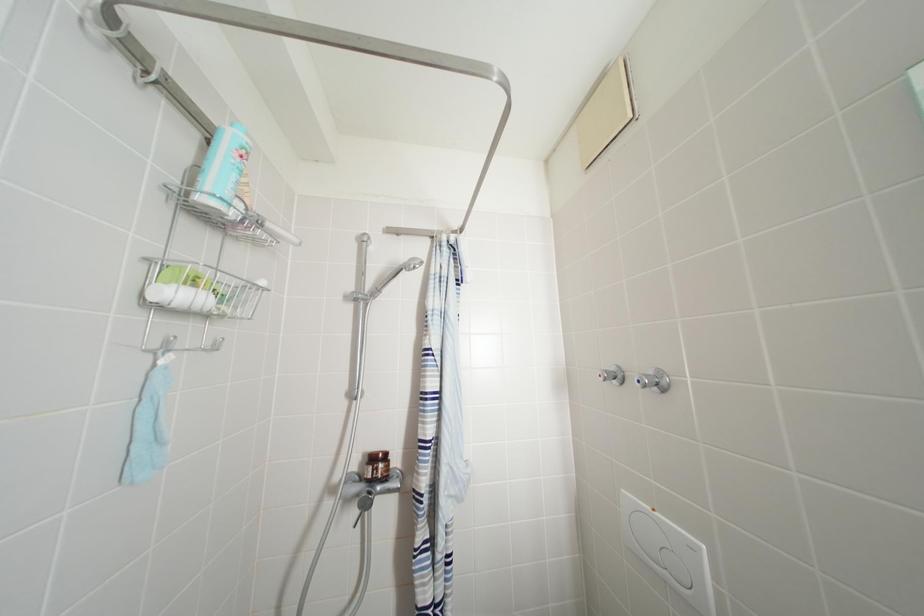
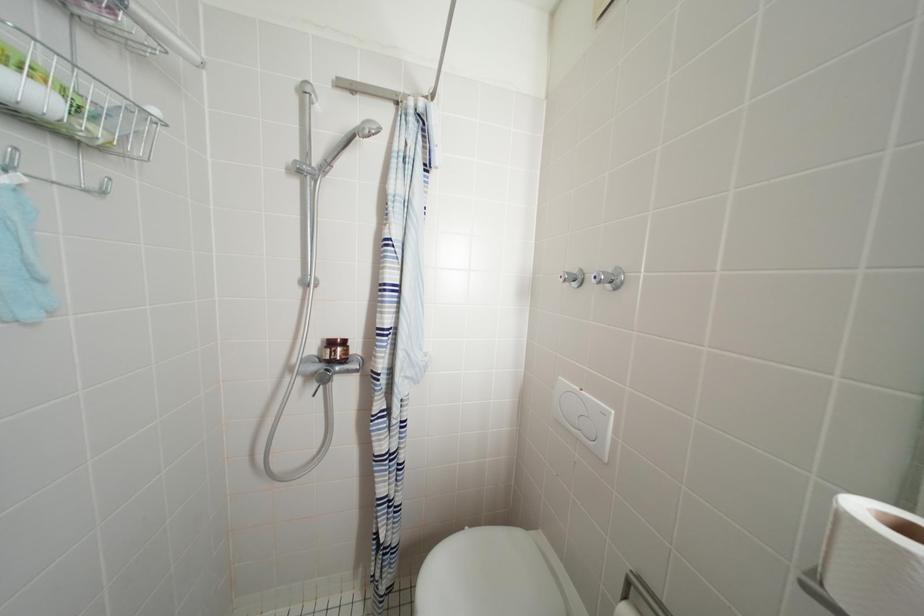
What movement of the cameraman would produce the second image?

The cameraman walked toward right, forward.